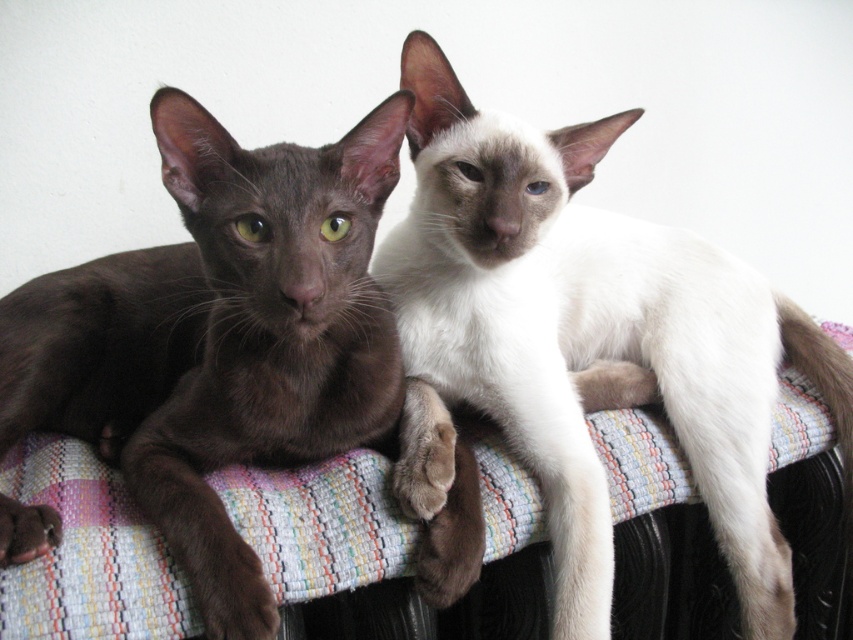
You are a cat owner who wants to place a small toy between the two cats so they can play together. The toy is 20 centimeters long. Will the toy fit between the white silky fur cat at center and the shiny brown cat at left without overlapping them?

The distance between the white silky fur cat at center and the shiny brown cat at left is 23.40 centimeters. Since the toy is 20 centimeters long, it will fit between them without overlapping because 20 cm is less than 23.40 cm.

You are a photographer trying to capture the white silky fur cat at center. The camera you are using has a focus point at coordinate point (584, 340). Will this focus point help you capture the white silky fur cat at center?

The white silky fur cat at center is represented by point (584, 340), so yes, the focus point at coordinate point (584, 340) will help you capture the white silky fur cat at center.

You are a photographer trying to capture a closeup of the white silky fur cat at center. The camera you are using has a focal length of 100mm. If you want to maintain the same level of detail in the photo, what should you adjust if you switch to a 50mm lens?

To maintain the same level of detail when switching to a 50mm lens, you should double the distance between the camera and the white silky fur cat at center. This is because a shorter focal length requires increasing the distance to keep the subject the same size in the frame.